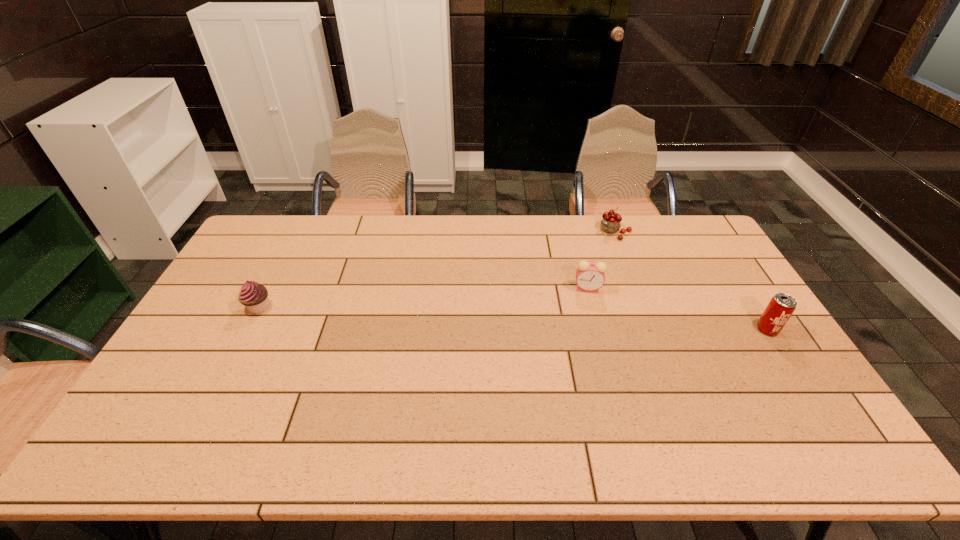
At what (x,y) coordinates should I click in order to perform the action: click on blank region between the third nearest object and the cupcake. Please return your answer as a coordinate pair (x, y). The image size is (960, 540). Looking at the image, I should click on (423, 298).

At what (x,y) coordinates should I click in order to perform the action: click on blank region between the pot filled with cherries and the nearest object. Please return your answer as a coordinate pair (x, y). Looking at the image, I should click on (690, 281).

What are the coordinates of `vacant space in between the cupcake and the beer can` in the screenshot? It's located at (513, 318).

Where is `free space that is in between the third object from left to right and the cupcake`? This screenshot has width=960, height=540. free space that is in between the third object from left to right and the cupcake is located at coordinates (436, 269).

This screenshot has width=960, height=540. Find the location of `free space between the rightmost object and the third object from right to left`. free space between the rightmost object and the third object from right to left is located at coordinates (678, 309).

Identify which object is located as the second nearest to the third object from right to left. Please provide its 2D coordinates. Your answer should be formatted as a tuple, i.e. [(x, y)], where the tuple contains the x and y coordinates of a point satisfying the conditions above.

[(780, 308)]

Identify which object is the second closest to the beer can. Please provide its 2D coordinates. Your answer should be formatted as a tuple, i.e. [(x, y)], where the tuple contains the x and y coordinates of a point satisfying the conditions above.

[(611, 222)]

Where is `blank space that satisfies the following two spatial constraints: 1. on the front side of the rightmost object; 2. on the left side of the second object from left to right`? The height and width of the screenshot is (540, 960). blank space that satisfies the following two spatial constraints: 1. on the front side of the rightmost object; 2. on the left side of the second object from left to right is located at coordinates (598, 329).